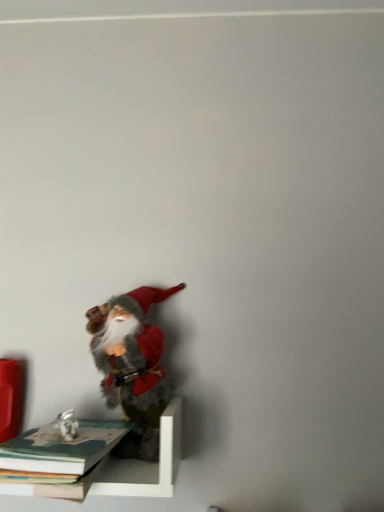
Question: Is point (71, 496) positioned closer to the camera than point (107, 434)?

Choices:
 (A) farther
 (B) closer

Answer: (B)

Question: Is hardcover book at lower left, which is the second book from top to bottom, inside the boundaries of hardcover book at lower left, which appears as the second book when ordered from the bottom, or outside?

Choices:
 (A) outside
 (B) inside

Answer: (A)

Question: Estimate the real-world distances between objects in this image. Which object is farther from the hardcover book at lower left, positioned as the first book in bottom-to-top order?

Choices:
 (A) hardcover book at lower left, which appears as the second book when ordered from the bottom
 (B) white matte shelf at lower left
 (C) fuzzy felt santa at lower left

Answer: (C)

Question: Considering the real-world distances, which object is farthest from the fuzzy felt santa at lower left?

Choices:
 (A) white matte shelf at lower left
 (B) hardcover book at lower left, which appears as the second book when ordered from the bottom
 (C) hardcover book at lower left, positioned as the first book in bottom-to-top order

Answer: (C)